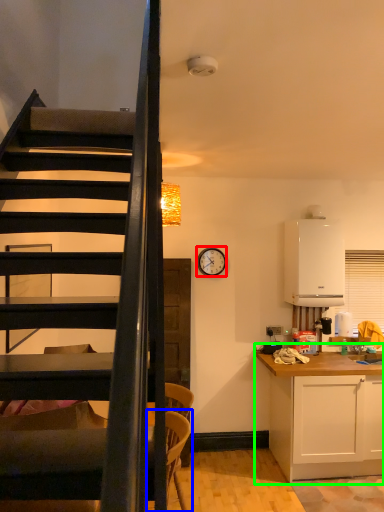
Question: Which is farther away from clock (highlighted by a red box)? armchair (highlighted by a blue box) or cabinetry (highlighted by a green box)?

Choices:
 (A) armchair
 (B) cabinetry

Answer: (A)